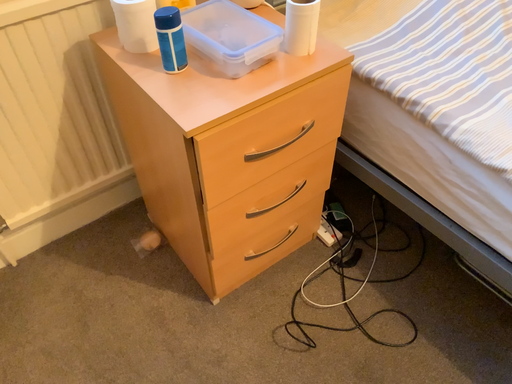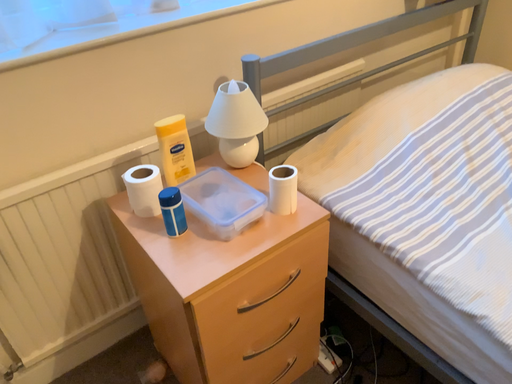
Question: How did the camera likely rotate when shooting the video?

Choices:
 (A) rotated upward
 (B) rotated downward

Answer: (A)